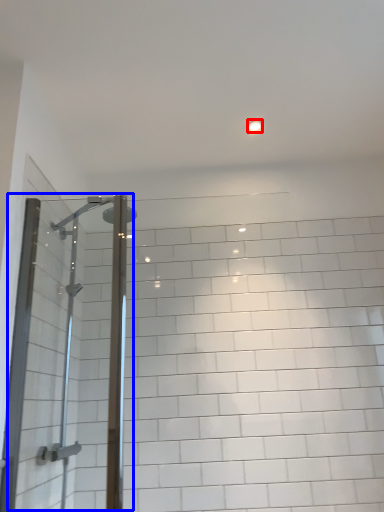
Question: Which of the following is the farthest to the observer, light fixture (highlighted by a red box) or screen door (highlighted by a blue box)?

Choices:
 (A) light fixture
 (B) screen door

Answer: (A)